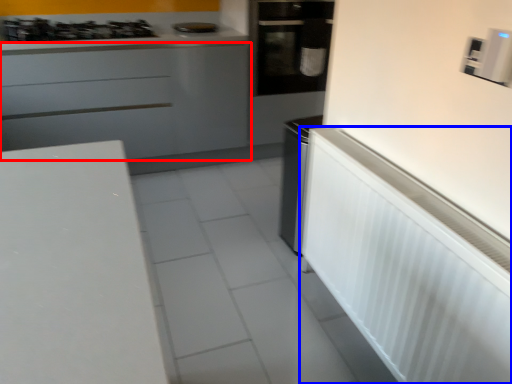
Question: Among these objects, which one is nearest to the camera, cabinetry (highlighted by a red box) or appliance (highlighted by a blue box)?

Choices:
 (A) cabinetry
 (B) appliance

Answer: (B)